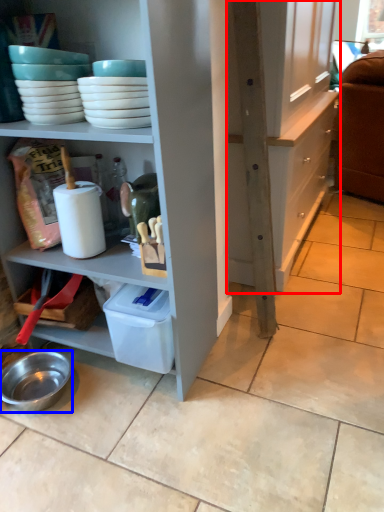
Question: Which object appears closest to the camera in this image, cabinetry (highlighted by a red box) or bowl (highlighted by a blue box)?

Choices:
 (A) cabinetry
 (B) bowl

Answer: (B)